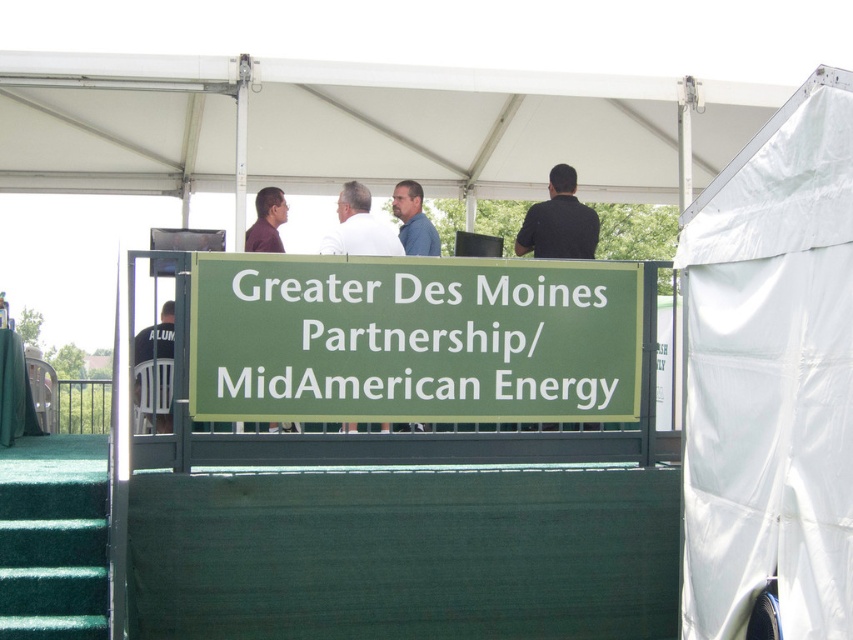
Question: Estimate the real-world distances between objects in this image. Which object is farther from the blue shirt at center?

Choices:
 (A) matte brown shirt at upper center
 (B) black shirt at upper center
 (C) white matte shirt at center
 (D) green matte sign at center

Answer: (D)

Question: Which point appears closest to the camera in this image?

Choices:
 (A) (259, 240)
 (B) (82, 593)
 (C) (401, 241)
 (D) (735, 241)

Answer: (D)

Question: Which point is farther to the camera?

Choices:
 (A) (704, 634)
 (B) (345, 182)
 (C) (433, 243)
 (D) (556, 355)

Answer: (B)

Question: Is green matte sign at center further to the viewer compared to white matte shirt at center?

Choices:
 (A) no
 (B) yes

Answer: (A)

Question: Is black shirt at upper center positioned before blue shirt at center?

Choices:
 (A) no
 (B) yes

Answer: (A)

Question: Observing the image, what is the correct spatial positioning of white fabric tent at upper right in reference to green carpeted stairs at lower left?

Choices:
 (A) left
 (B) right

Answer: (B)